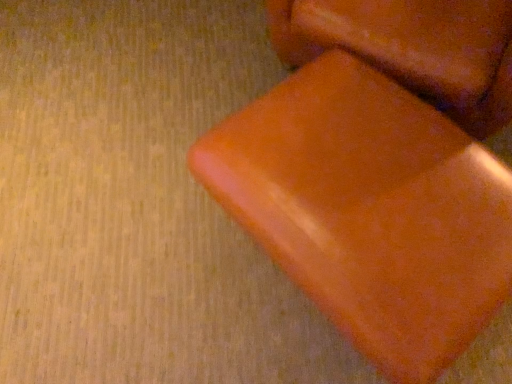
Question: Is orange matte block at center in front of or behind orange matte bean bag chair at center in the image?

Choices:
 (A) behind
 (B) front

Answer: (A)

Question: Looking at their shapes, would you say orange matte block at center is wider or thinner than orange matte bean bag chair at center?

Choices:
 (A) thin
 (B) wide

Answer: (B)

Question: Considering the relative positions of orange matte block at center and orange matte bean bag chair at center in the image provided, is orange matte block at center to the left or to the right of orange matte bean bag chair at center?

Choices:
 (A) right
 (B) left

Answer: (A)

Question: Is orange matte bean bag chair at center bigger or smaller than orange matte block at center?

Choices:
 (A) big
 (B) small

Answer: (B)

Question: From the image's perspective, is orange matte bean bag chair at center above or below orange matte block at center?

Choices:
 (A) above
 (B) below

Answer: (B)

Question: Based on their positions, is orange matte bean bag chair at center located to the left or right of orange matte block at center?

Choices:
 (A) right
 (B) left

Answer: (B)

Question: Would you say orange matte bean bag chair at center is inside or outside orange matte block at center?

Choices:
 (A) outside
 (B) inside

Answer: (A)